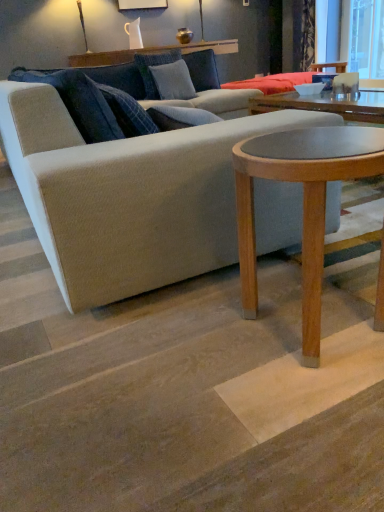
Question: Considering the positions of point pyautogui.click(x=238, y=214) and point pyautogui.click(x=370, y=71), is point pyautogui.click(x=238, y=214) closer or farther from the camera than point pyautogui.click(x=370, y=71)?

Choices:
 (A) closer
 (B) farther

Answer: (A)

Question: From the image's perspective, is light brown wood coffee table at center located above or below transparent glass window screen at upper right?

Choices:
 (A) above
 (B) below

Answer: (B)

Question: Which is farther from the textured gray pillow at center, acting as the 1th pillow starting from the front?

Choices:
 (A) light brown wood coffee table at center
 (B) beige fabric couch at center
 (C) textured blue pillow at upper center, the 2th pillow when ordered from front to back
 (D) transparent glass window screen at upper right
 (E) velvet dark blue curtain at upper right

Answer: (D)

Question: Estimate the real-world distances between objects in this image. Which object is closer to the beige fabric couch at center?

Choices:
 (A) textured blue pillow at upper center, arranged as the 1th pillow when viewed from the back
 (B) textured gray pillow at center, acting as the 1th pillow starting from the front
 (C) velvet dark blue curtain at upper right
 (D) transparent glass window screen at upper right
 (E) light brown wood coffee table at center

Answer: (E)